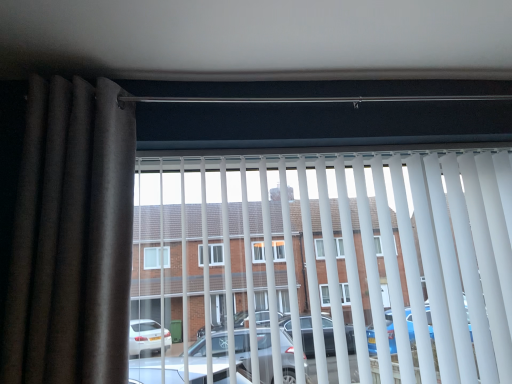
Question: In terms of width, does white plastic blinds at center look wider or thinner when compared to brown fabric curtain at left?

Choices:
 (A) wide
 (B) thin

Answer: (B)

Question: Based on their sizes in the image, would you say white plastic blinds at center is bigger or smaller than brown fabric curtain at left?

Choices:
 (A) big
 (B) small

Answer: (A)

Question: From their relative heights in the image, would you say white plastic blinds at center is taller or shorter than brown fabric curtain at left?

Choices:
 (A) short
 (B) tall

Answer: (A)

Question: Based on their sizes in the image, would you say brown fabric curtain at left is bigger or smaller than white plastic blinds at center?

Choices:
 (A) big
 (B) small

Answer: (B)

Question: Is point (82, 104) positioned closer to the camera than point (329, 276)?

Choices:
 (A) farther
 (B) closer

Answer: (B)

Question: From a real-world perspective, is brown fabric curtain at left physically located above or below white plastic blinds at center?

Choices:
 (A) above
 (B) below

Answer: (A)

Question: Is brown fabric curtain at left taller or shorter than white plastic blinds at center?

Choices:
 (A) tall
 (B) short

Answer: (A)